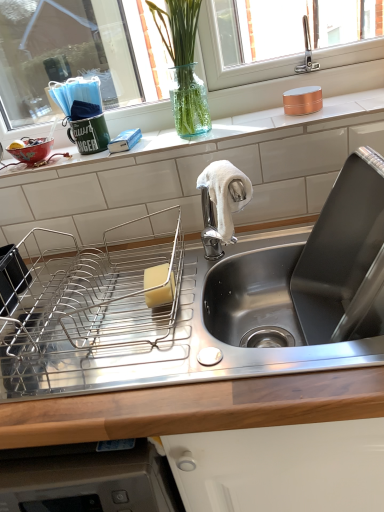
This screenshot has height=512, width=384. I want to click on vacant area that is in front of yellow sponge at sink, so click(162, 352).